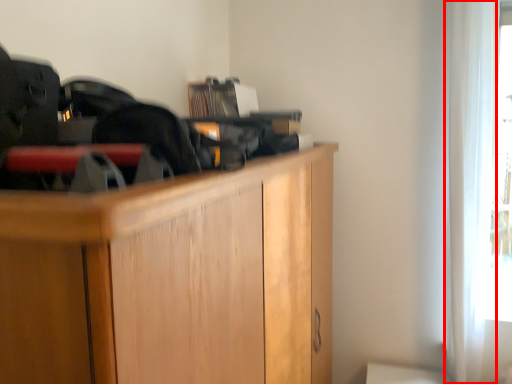
Question: In this image, where is curtain (annotated by the red box) located relative to cabinetry?

Choices:
 (A) left
 (B) right

Answer: (B)